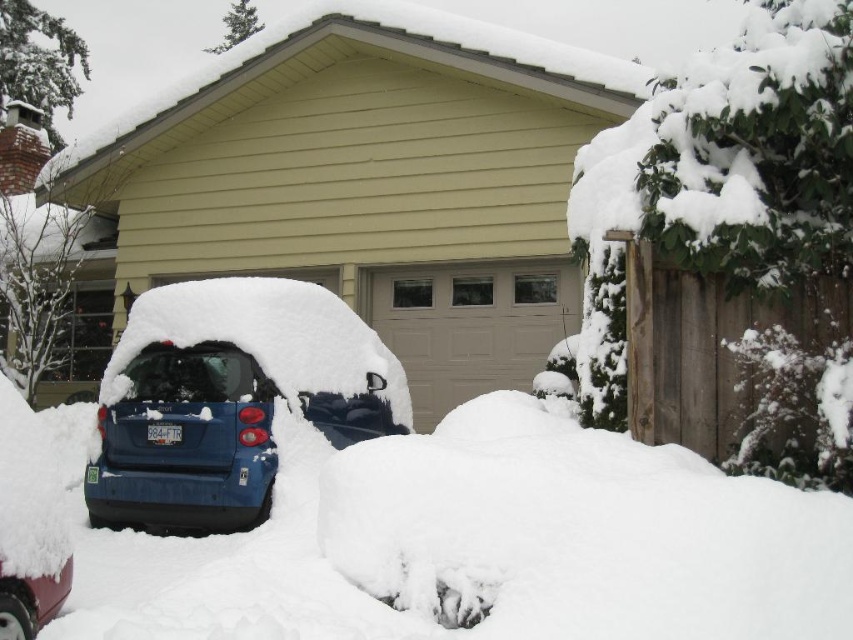
You are a snowplow operator who needs to clear the driveway. The driveway is 2 meters wide. You see a matte blue car at center and a shiny red car at lower left. Which car can you move to the side to make space for the plow without blocking the driveway?

The shiny red car at lower left has a smaller width than the matte blue car at center, so moving the shiny red car at lower left would allow more space for the snowplow to clear the driveway without blocking it.

You are a snowplow driver who needs to clear the driveway. You see the matte blue car at lower left and the shiny red car at lower left. Which car takes up more space in the driveway?

The matte blue car at lower left takes up more space in the driveway because its width is larger than the shiny red car at lower left.